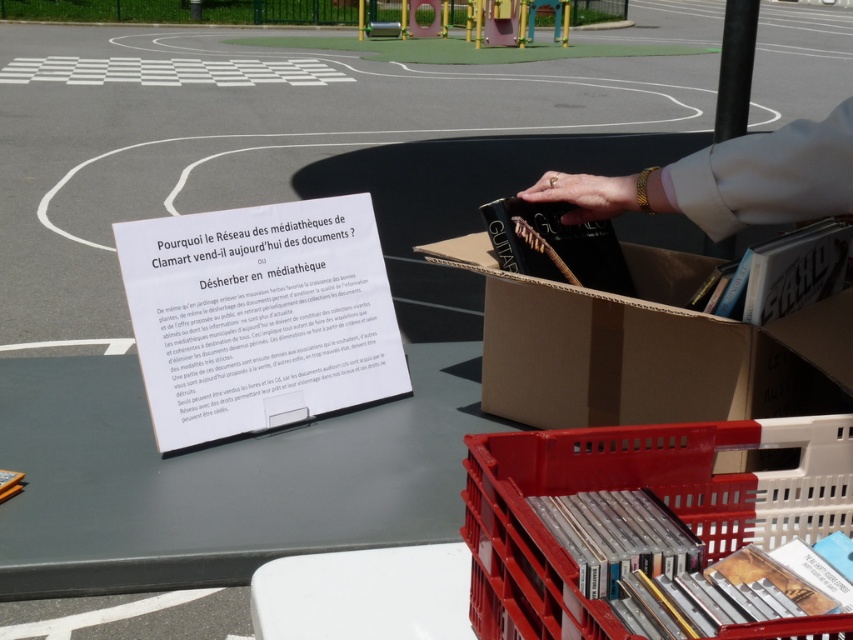
You are standing in the parking lot scene and want to place a new item between the two points marked as point (838, 410) and point (828, 460). Which point should you move toward first to ensure the item is placed correctly?

You should move toward point (838, 410) first because it is closer to you than point (828, 460), which is further away.

You are helping to organize items in a parking lot. You have a brown cardboard box at center and a gold bracelet at upper right. Which item can hold more items?

The brown cardboard box at center can hold more items because it is bigger than the gold bracelet at upper right.